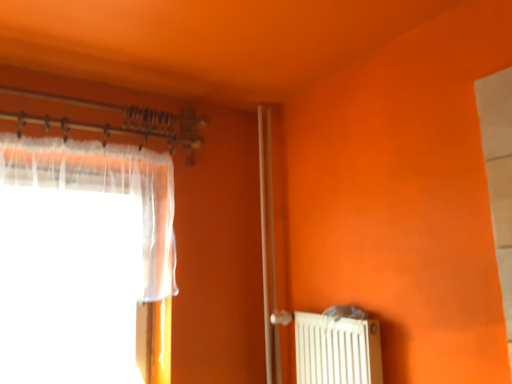
Question: Is translucent fabric curtain at left thinner than white matte radiator at lower right?

Choices:
 (A) no
 (B) yes

Answer: (A)

Question: From a real-world perspective, is translucent fabric curtain at left physically below white matte radiator at lower right?

Choices:
 (A) yes
 (B) no

Answer: (B)

Question: Does translucent fabric curtain at left have a greater height compared to white matte radiator at lower right?

Choices:
 (A) yes
 (B) no

Answer: (A)

Question: Is translucent fabric curtain at left at the right side of white matte radiator at lower right?

Choices:
 (A) no
 (B) yes

Answer: (A)

Question: Could you tell me if translucent fabric curtain at left is turned towards white matte radiator at lower right?

Choices:
 (A) yes
 (B) no

Answer: (B)

Question: Relative to translucent fabric curtain at left, is clear glass screen door at center in front or behind?

Choices:
 (A) behind
 (B) front

Answer: (A)

Question: From a real-world perspective, relative to translucent fabric curtain at left, is clear glass screen door at center vertically above or below?

Choices:
 (A) below
 (B) above

Answer: (A)

Question: Choose the correct answer: Is clear glass screen door at center inside translucent fabric curtain at left or outside it?

Choices:
 (A) outside
 (B) inside

Answer: (A)

Question: In terms of width, does clear glass screen door at center look wider or thinner when compared to translucent fabric curtain at left?

Choices:
 (A) wide
 (B) thin

Answer: (B)

Question: From their relative heights in the image, would you say white matte radiator at lower right is taller or shorter than clear glass screen door at center?

Choices:
 (A) short
 (B) tall

Answer: (A)

Question: Is white matte radiator at lower right wider or thinner than clear glass screen door at center?

Choices:
 (A) thin
 (B) wide

Answer: (B)

Question: From the image's perspective, relative to clear glass screen door at center, is white matte radiator at lower right above or below?

Choices:
 (A) above
 (B) below

Answer: (B)

Question: From a real-world perspective, is white matte radiator at lower right physically located above or below clear glass screen door at center?

Choices:
 (A) above
 (B) below

Answer: (B)

Question: Considering the positions of white matte radiator at lower right and translucent fabric curtain at left in the image, is white matte radiator at lower right wider or thinner than translucent fabric curtain at left?

Choices:
 (A) thin
 (B) wide

Answer: (A)

Question: Visually, is white matte radiator at lower right positioned to the left or to the right of translucent fabric curtain at left?

Choices:
 (A) left
 (B) right

Answer: (B)